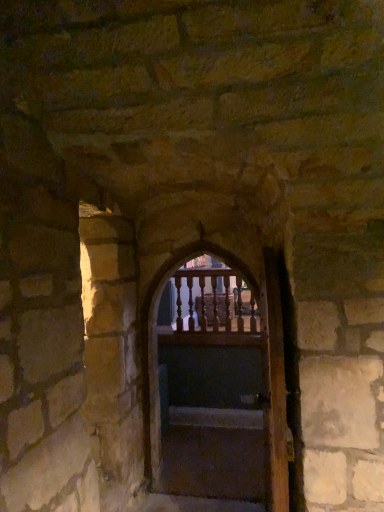
Question: Is smooth concrete stairs at center located outside wooden door at center, marked as the 1th door in a front-to-back arrangement?

Choices:
 (A) no
 (B) yes

Answer: (B)

Question: Is smooth concrete stairs at center to the right of wooden door at center, marked as the 1th door in a front-to-back arrangement, from the viewer's perspective?

Choices:
 (A) no
 (B) yes

Answer: (A)

Question: Can you confirm if smooth concrete stairs at center is bigger than wooden door at center, marked as the 1th door in a front-to-back arrangement?

Choices:
 (A) yes
 (B) no

Answer: (B)

Question: From the image's perspective, is smooth concrete stairs at center over wooden door at center, marked as the 1th door in a front-to-back arrangement?

Choices:
 (A) yes
 (B) no

Answer: (B)

Question: Can you confirm if smooth concrete stairs at center is taller than wooden door at center, marked as the 1th door in a front-to-back arrangement?

Choices:
 (A) yes
 (B) no

Answer: (B)

Question: Is point (192, 369) positioned closer to the camera than point (274, 391)?

Choices:
 (A) farther
 (B) closer

Answer: (A)

Question: Is wooden at center, acting as the second door starting from the front, spatially inside wooden door at center, which is the second door from back to front, or outside of it?

Choices:
 (A) outside
 (B) inside

Answer: (A)

Question: Considering the positions of wooden at center, which is counted as the first door, starting from the back, and wooden door at center, marked as the 1th door in a front-to-back arrangement, in the image, is wooden at center, which is counted as the first door, starting from the back, wider or thinner than wooden door at center, marked as the 1th door in a front-to-back arrangement,?

Choices:
 (A) thin
 (B) wide

Answer: (B)

Question: In the image, is wooden at center, which is counted as the first door, starting from the back, positioned in front of or behind wooden door at center, marked as the 1th door in a front-to-back arrangement?

Choices:
 (A) front
 (B) behind

Answer: (B)

Question: Considering the positions of point (274, 339) and point (261, 309), is point (274, 339) closer or farther from the camera than point (261, 309)?

Choices:
 (A) closer
 (B) farther

Answer: (A)

Question: Is wooden door at center, marked as the 1th door in a front-to-back arrangement, spatially inside wooden at center, which is counted as the first door, starting from the back, or outside of it?

Choices:
 (A) inside
 (B) outside

Answer: (B)

Question: Would you say wooden door at center, marked as the 1th door in a front-to-back arrangement, is to the left or to the right of wooden at center, which is counted as the first door, starting from the back, in the picture?

Choices:
 (A) left
 (B) right

Answer: (B)

Question: Looking at their shapes, would you say wooden door at center, which is the second door from back to front, is wider or thinner than wooden at center, which is counted as the first door, starting from the back?

Choices:
 (A) wide
 (B) thin

Answer: (B)

Question: From a real-world perspective, is smooth concrete stairs at center above or below wooden door at center, marked as the 1th door in a front-to-back arrangement?

Choices:
 (A) above
 (B) below

Answer: (B)

Question: Based on their positions, is smooth concrete stairs at center located to the left or right of wooden door at center, marked as the 1th door in a front-to-back arrangement?

Choices:
 (A) right
 (B) left

Answer: (B)